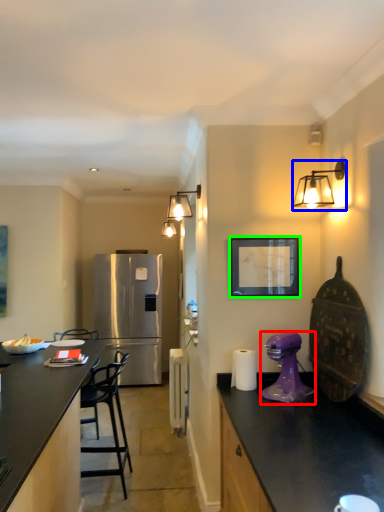
Question: Which object is positioned farthest from kitchen appliance (highlighted by a red box)? Select from light fixture (highlighted by a blue box) and picture frame (highlighted by a green box).

Choices:
 (A) light fixture
 (B) picture frame

Answer: (A)